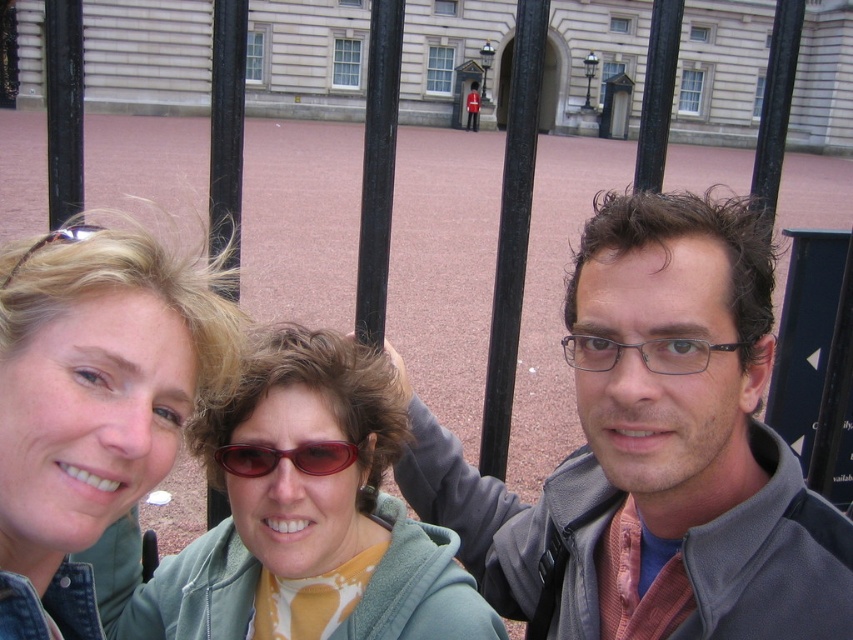
You are a photographer trying to capture a closeup of the gray fleece jacket at center and sunglasses at center. Based on their sizes, which object should you zoom in on first to ensure both are in focus?

The gray fleece jacket at center is wider than the sunglasses at center. To ensure both are in focus, you should zoom in on the gray fleece jacket at center first since it is larger and requires more space in the frame.

You are standing at the center of the paved area in front of the palace. You see two points marked on the ground at coordinates point (96, 449) and point (604, 362). Which point is closer to you?

Point (96, 449) is in front of point (604, 362), so it is closer to you.

You are a photographer trying to capture a clear shot of the sunglasses at center and the denim jacket at lower left. Based on their positions, which object is closer to the left edge of the photo?

The denim jacket at lower left is to the left of the sunglasses at center, so it is closer to the left edge of the photo.